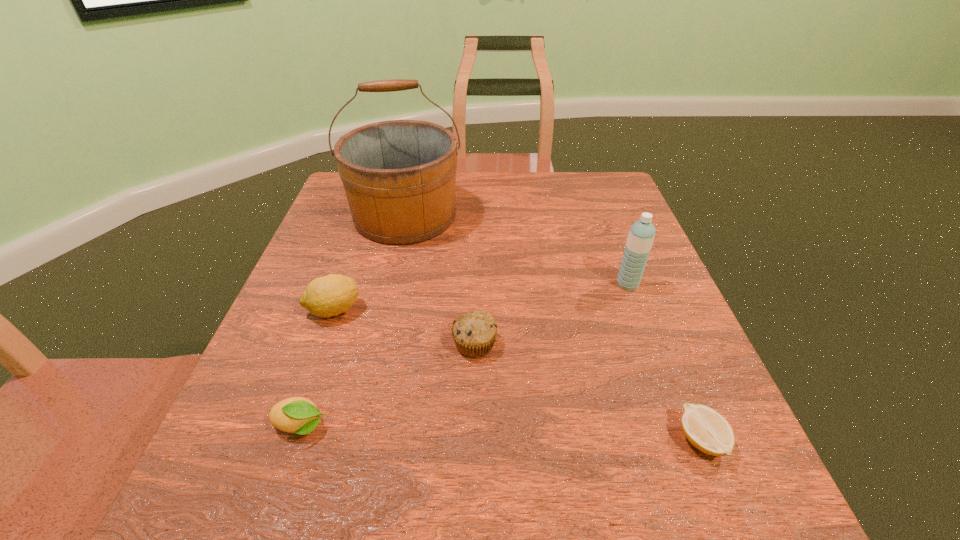
Where is `the tallest object`? This screenshot has width=960, height=540. the tallest object is located at coordinates (399, 176).

Where is `the farthest object`? the farthest object is located at coordinates (399, 176).

You are a GUI agent. You are given a task and a screenshot of the screen. Output one action in this format:
    pyautogui.click(x=<x>, y=<y>)
    Task: Click on the second tallest object
    The height and width of the screenshot is (540, 960).
    Given the screenshot: What is the action you would take?
    pyautogui.click(x=641, y=235)

Locate an element on the screen. The image size is (960, 540). water bottle is located at coordinates (641, 235).

You are a GUI agent. You are given a task and a screenshot of the screen. Output one action in this format:
    pyautogui.click(x=<x>, y=<y>)
    Task: Click on the tallest lemon
    The image size is (960, 540).
    Given the screenshot: What is the action you would take?
    pyautogui.click(x=331, y=295)

At what (x,y) coordinates should I click in order to perform the action: click on the fourth nearest object. Please return your answer as a coordinate pair (x, y). The width and height of the screenshot is (960, 540). Looking at the image, I should click on (331, 295).

Where is `the third nearest object`? Image resolution: width=960 pixels, height=540 pixels. the third nearest object is located at coordinates (474, 332).

Where is `the fifth tallest object`? The width and height of the screenshot is (960, 540). the fifth tallest object is located at coordinates (298, 415).

Find the location of a particular element. the rightmost lemon is located at coordinates (707, 430).

Find the location of a particular element. The height and width of the screenshot is (540, 960). the shortest lemon is located at coordinates (707, 430).